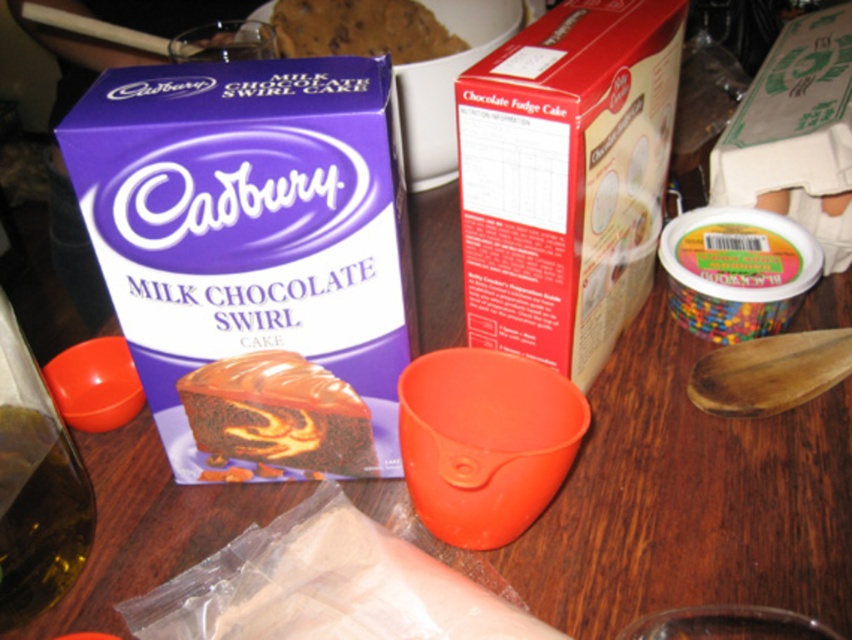
You are a baker who needs to reach the purple cardboard box at upper left to get the cake mix. The tallest object in the scene is 50 centimeters. Can you safely lift the box without knocking over any items closer to you?

The purple cardboard box at upper left is 34.64 centimeters from viewer, which is shorter than the tallest object in the scene at 50 centimeters. Therefore, lifting it might not be safe as there could be taller items closer to you that might be knocked over.